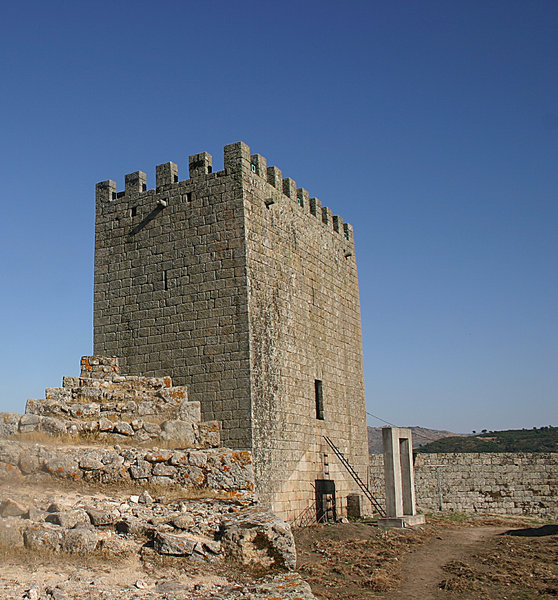
Find the location of `window`. window is located at coordinates (316, 406).